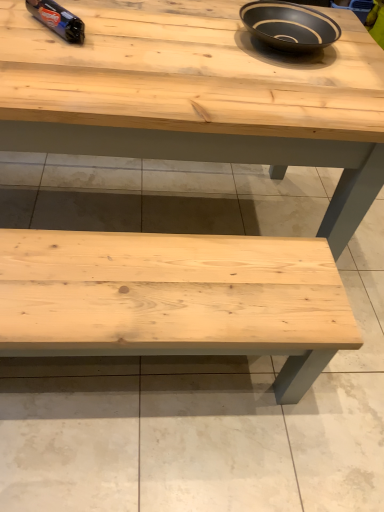
Where is `vacant space in natural wood table at center (from a real-world perspective)`? This screenshot has width=384, height=512. vacant space in natural wood table at center (from a real-world perspective) is located at coordinates (144, 205).